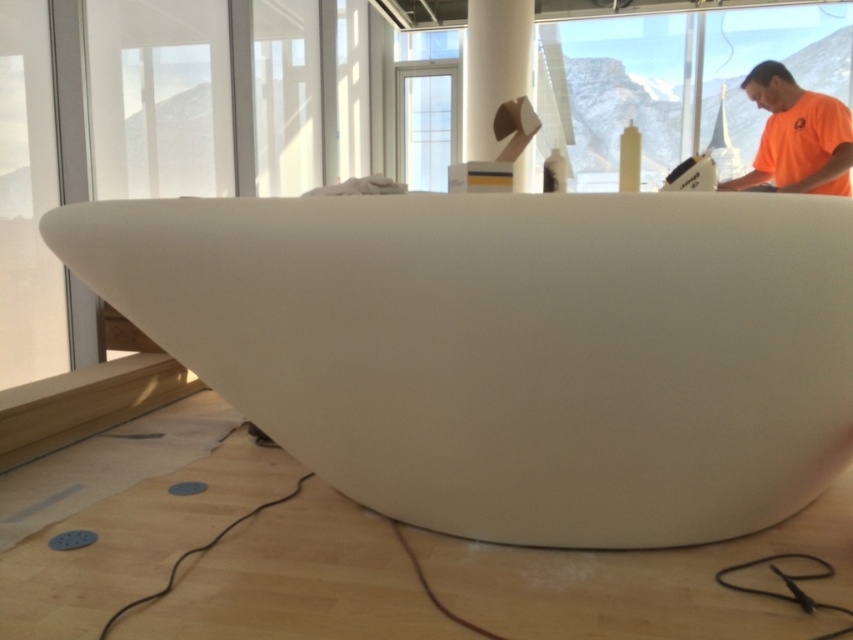
You are a delivery person standing at the entrance of the room. You need to place a package that is 3 feet long on the floor near the white matte bathtub at center. Is there enough space between you and the bathtub to place the package without moving the bathtub?

Result: The distance between you and the white matte bathtub at center is 3.40 feet. Since the package is 3 feet long, there is enough space to place it without moving the bathtub.